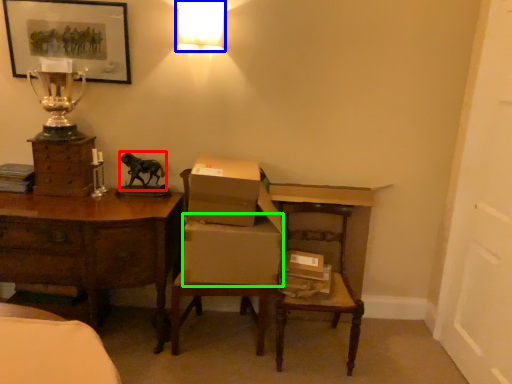
Question: Which object is the farthest from animal (highlighted by a red box)? Choose among these: lamp (highlighted by a blue box) or cardboard box (highlighted by a green box).

Choices:
 (A) lamp
 (B) cardboard box

Answer: (A)